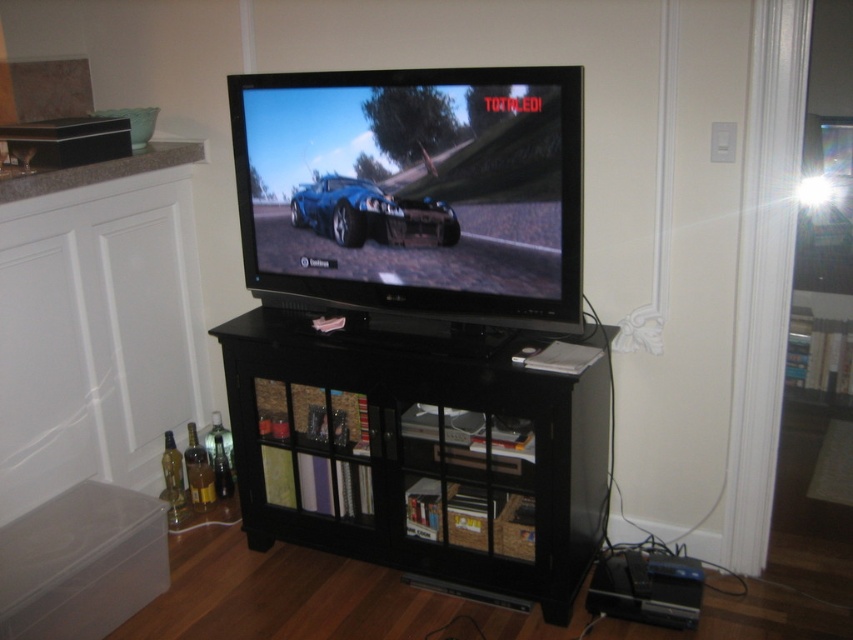
Consider the image. Can you confirm if black glossy entertainment center at center is wider than black glossy flat screen tv at center?

Correct, the width of black glossy entertainment center at center exceeds that of black glossy flat screen tv at center.

The height and width of the screenshot is (640, 853). What do you see at coordinates (418, 451) in the screenshot?
I see `black glossy entertainment center at center` at bounding box center [418, 451].

Where is `black glossy entertainment center at center`? This screenshot has height=640, width=853. black glossy entertainment center at center is located at coordinates (418, 451).

Who is taller, black glossy entertainment center at center or glossy blue car at center?

With more height is black glossy entertainment center at center.

Who is more forward, (404, 493) or (389, 244)?

Point (389, 244) is in front.

Identify the location of black glossy entertainment center at center. Image resolution: width=853 pixels, height=640 pixels. (418, 451).

Is black glossy flat screen tv at center positioned in front of glossy blue car at center?

That is True.

In the scene shown: Which of these two, black glossy flat screen tv at center or glossy blue car at center, stands taller?

Standing taller between the two is black glossy flat screen tv at center.

Image resolution: width=853 pixels, height=640 pixels. What are the coordinates of `black glossy flat screen tv at center` in the screenshot? It's located at (415, 189).